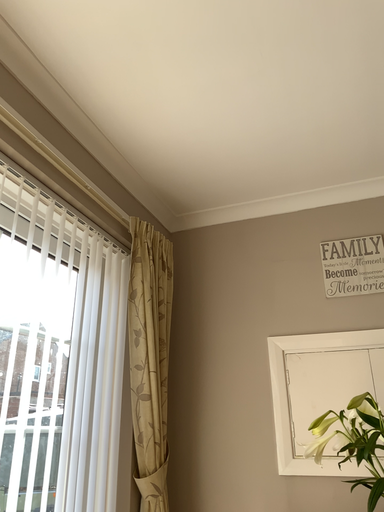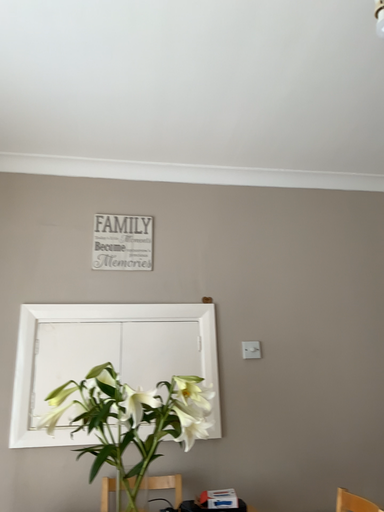
Question: Which way did the camera rotate in the video?

Choices:
 (A) rotated left
 (B) rotated right

Answer: (B)